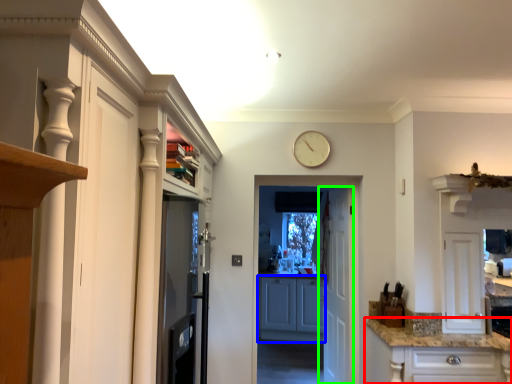
Question: Which object is positioned farthest from cabinetry (highlighted by a red box)? Select from cabinetry (highlighted by a blue box) and door (highlighted by a green box).

Choices:
 (A) cabinetry
 (B) door

Answer: (A)